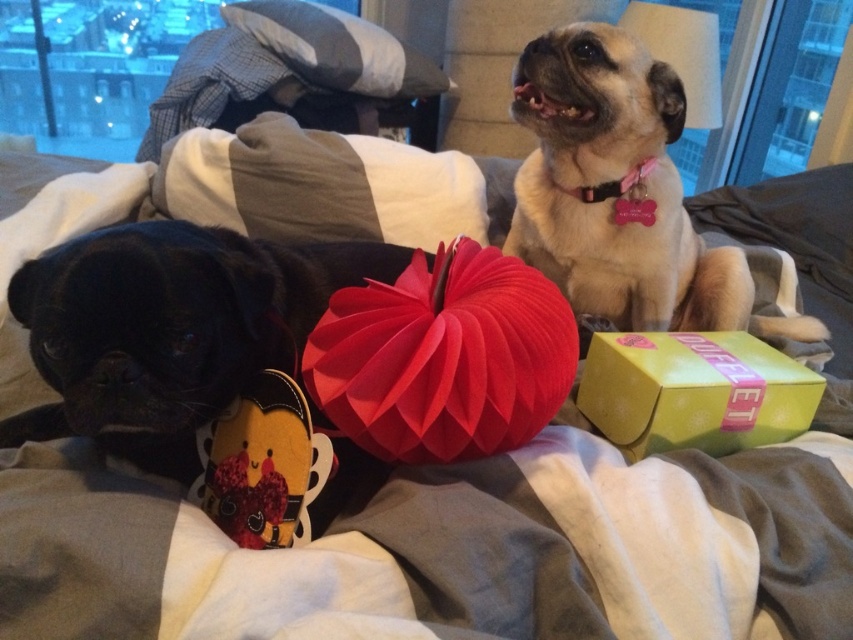
You are a photographer setting up a shoot in this room. You want to place a new camera on the bed so that it can capture both the green matte gift box at center right and the velvety plush heart at lower left clearly in the frame. Where should you position the camera relative to the bed?

The camera should be positioned in a spot where it can see both objects. Since the velvety plush heart at lower left is behind the green matte gift box at center right, placing the camera slightly above and to the side of the green matte gift box at center right would allow it to capture both objects without obstruction. Alternatively, positioning the camera higher up might help see around the green matte gift box at center right to the velvety plush heart at lower left.